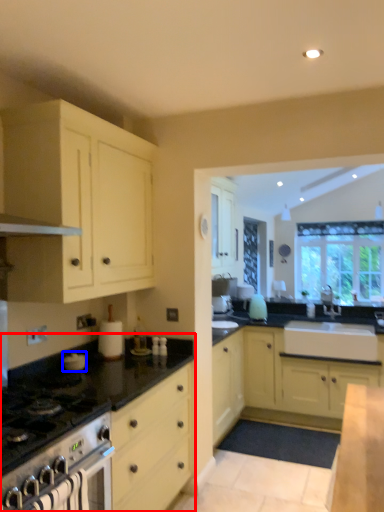
Question: Which of the following is the closest to the observer, countertop (highlighted by a red box) or appliance (highlighted by a blue box)?

Choices:
 (A) countertop
 (B) appliance

Answer: (A)